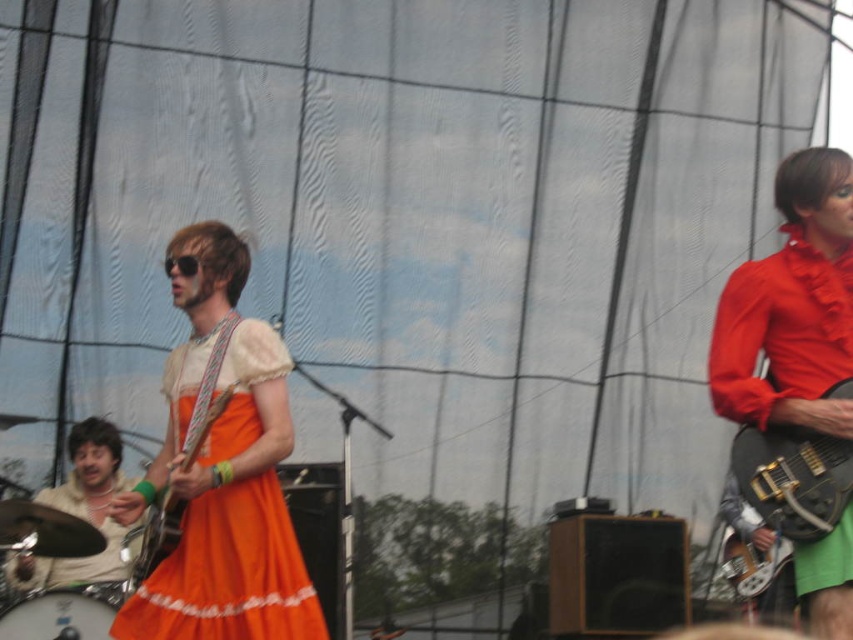
Does orange satin dress at center appear on the right side of beige fabric drum set at lower left?

Yes, orange satin dress at center is to the right of beige fabric drum set at lower left.

Between point (289, 609) and point (96, 508), which one is positioned behind?

Positioned behind is point (96, 508).

Locate an element on the screen. The width and height of the screenshot is (853, 640). orange satin dress at center is located at coordinates (228, 573).

How far apart are black glossy electric guitar at right and white drum head at lower left?

The distance of black glossy electric guitar at right from white drum head at lower left is 5.01 meters.

Is point (778, 508) positioned in front of point (103, 627)?

That is True.

Is point (780, 467) closer to camera compared to point (80, 627)?

Yes, point (780, 467) is in front of point (80, 627).

Locate an element on the screen. The height and width of the screenshot is (640, 853). black glossy electric guitar at right is located at coordinates (792, 477).

Is black glossy electric guitar at right smaller than beige fabric drum set at lower left?

Yes, black glossy electric guitar at right is smaller than beige fabric drum set at lower left.

Who is lower down, black glossy electric guitar at right or beige fabric drum set at lower left?

Positioned lower is beige fabric drum set at lower left.

Is point (798, 429) in front of point (111, 534)?

Yes, point (798, 429) is in front of point (111, 534).

Find the location of `black glossy electric guitar at right`. black glossy electric guitar at right is located at coordinates (792, 477).